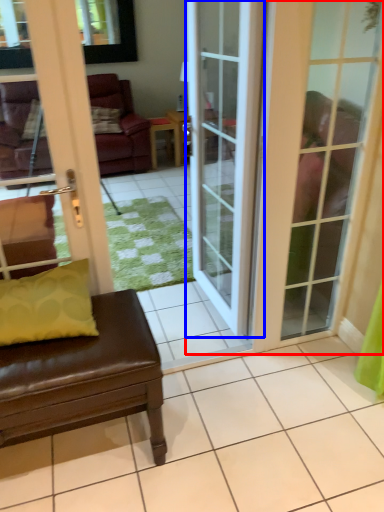
Question: Which object is closer to the camera taking this photo, door (highlighted by a red box) or door (highlighted by a blue box)?

Choices:
 (A) door
 (B) door

Answer: (A)